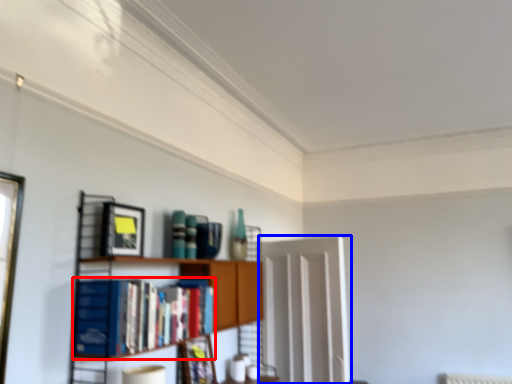
Question: Among these objects, which one is farthest to the camera, book (highlighted by a red box) or glass door (highlighted by a blue box)?

Choices:
 (A) book
 (B) glass door

Answer: (B)